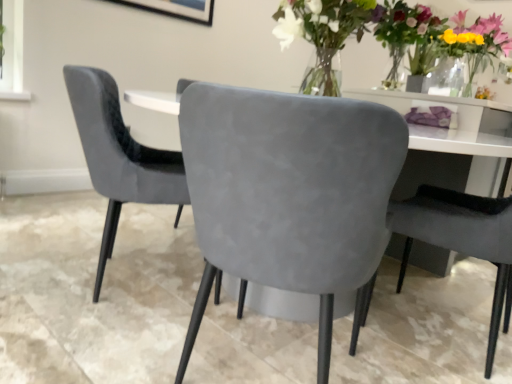
The height and width of the screenshot is (384, 512). I want to click on vacant space that is to the left of suede gray chair at center, which appears as the second chair when viewed from the right, so click(x=100, y=344).